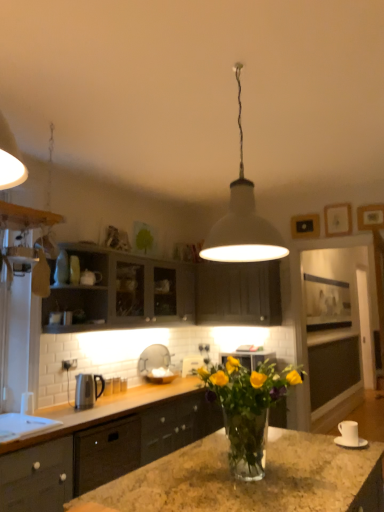
Question: From a real-world perspective, is matte black cabinets at center, marked as the third cabinetry in a top-to-bottom arrangement, located beneath white matte pendant light at center?

Choices:
 (A) yes
 (B) no

Answer: (A)

Question: From the image's perspective, would you say matte black cabinets at center, marked as the third cabinetry in a top-to-bottom arrangement, is positioned over white matte pendant light at center?

Choices:
 (A) no
 (B) yes

Answer: (A)

Question: Considering the relative sizes of matte black cabinets at center, which is the first cabinetry from bottom to top, and white matte pendant light at center in the image provided, is matte black cabinets at center, which is the first cabinetry from bottom to top, shorter than white matte pendant light at center?

Choices:
 (A) no
 (B) yes

Answer: (B)

Question: Is matte black cabinets at center, marked as the third cabinetry in a top-to-bottom arrangement, positioned before white matte pendant light at center?

Choices:
 (A) yes
 (B) no

Answer: (B)

Question: Are matte black cabinets at center, marked as the third cabinetry in a top-to-bottom arrangement, and white matte pendant light at center far apart?

Choices:
 (A) no
 (B) yes

Answer: (B)

Question: In terms of height, does satin black kettle at left, placed as the 2th appliance when sorted from back to front, look taller or shorter compared to matte gray cabinets at upper left, positioned as the 1th cabinetry in top-to-bottom order?

Choices:
 (A) tall
 (B) short

Answer: (B)

Question: Relative to matte gray cabinets at upper left, positioned as the 1th cabinetry in top-to-bottom order, is satin black kettle at left, which is the third appliance in right-to-left order, in front or behind?

Choices:
 (A) behind
 (B) front

Answer: (A)

Question: From the image's perspective, is satin black kettle at left, placed as the 2th appliance when sorted from back to front, positioned above or below matte gray cabinets at upper left, positioned as the 1th cabinetry in top-to-bottom order?

Choices:
 (A) above
 (B) below

Answer: (B)

Question: Considering the positions of satin black kettle at left, which is the third appliance in right-to-left order, and matte gray cabinets at upper left, positioned as the 1th cabinetry in top-to-bottom order, in the image, is satin black kettle at left, which is the third appliance in right-to-left order, wider or thinner than matte gray cabinets at upper left, positioned as the 1th cabinetry in top-to-bottom order,?

Choices:
 (A) thin
 (B) wide

Answer: (A)

Question: Considering the positions of matte gray cabinets at upper left, positioned as the 1th cabinetry in top-to-bottom order, and translucent glass vase at center in the image, is matte gray cabinets at upper left, positioned as the 1th cabinetry in top-to-bottom order, wider or thinner than translucent glass vase at center?

Choices:
 (A) wide
 (B) thin

Answer: (B)

Question: Considering the relative positions of matte gray cabinets at upper left, placed as the third cabinetry when sorted from bottom to top, and translucent glass vase at center in the image provided, is matte gray cabinets at upper left, placed as the third cabinetry when sorted from bottom to top, to the left or to the right of translucent glass vase at center?

Choices:
 (A) left
 (B) right

Answer: (A)

Question: Looking at the image, does matte gray cabinets at upper left, placed as the third cabinetry when sorted from bottom to top, seem bigger or smaller compared to translucent glass vase at center?

Choices:
 (A) small
 (B) big

Answer: (B)

Question: From the image's perspective, is matte gray cabinets at upper left, placed as the third cabinetry when sorted from bottom to top, located above or below translucent glass vase at center?

Choices:
 (A) below
 (B) above

Answer: (B)

Question: Considering the positions of point (206, 275) and point (354, 423), is point (206, 275) closer or farther from the camera than point (354, 423)?

Choices:
 (A) farther
 (B) closer

Answer: (A)

Question: From the image's perspective, relative to white ceramic cup at lower right, which appears as the first appliance when viewed from the front, is matte gray cabinets at upper left, positioned as the 1th cabinetry in top-to-bottom order, above or below?

Choices:
 (A) above
 (B) below

Answer: (A)